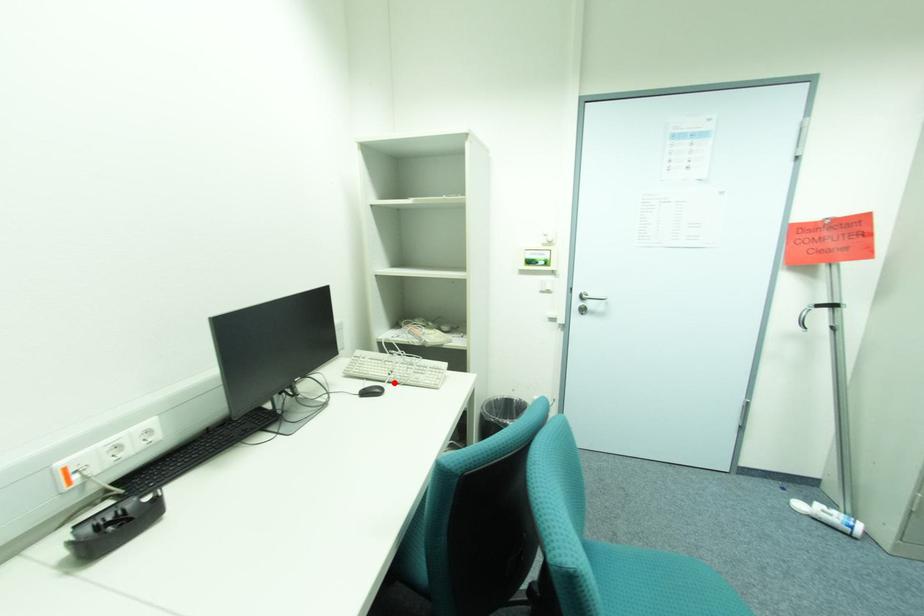
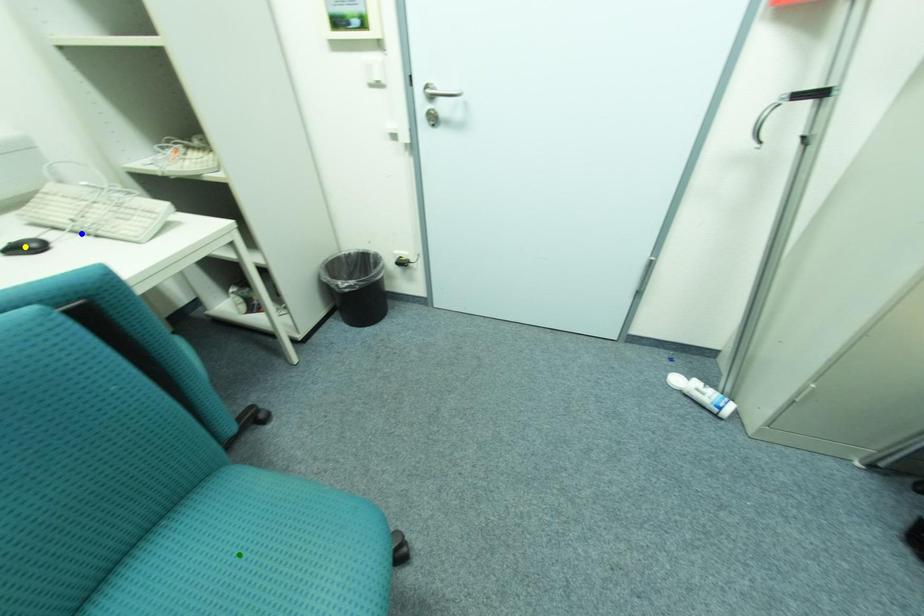
Question: I am providing you with two images of the same scene from different viewpoints. A red point is marked on the first image. You are given multiple points on the second image. Which spot in image 2 lines up with the point in image 1?

Choices:
 (A) yellow point
 (B) blue point
 (C) green point

Answer: (B)